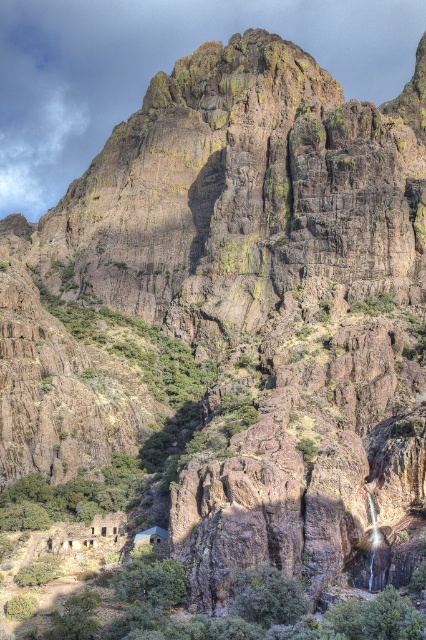
You are standing at the base of the towering cliff face and want to reach the small waterfall on the right side. Which direction should you head from the green leafy shrubs at lower center to reach the waterfall?

The green leafy shrubs at lower center are located at point (232,609). Since the waterfall is on the right side of the cliff, you should head towards the right from the green leafy shrubs at lower center to reach the waterfall.

You are a hiker who wants to set up camp near the green leafy shrubs at lower center. The rustic stone hut at center is already occupied. Can you set up camp between the two? Explain why or why not based on their positions.

The green leafy shrubs at lower center is located below the rustic stone hut at center, so there is space between them. However, since the rustic stone hut at center is occupied, you can set up camp between them if there is enough flat ground. But the description does not provide details about the terrain between them, so it is uncertain.